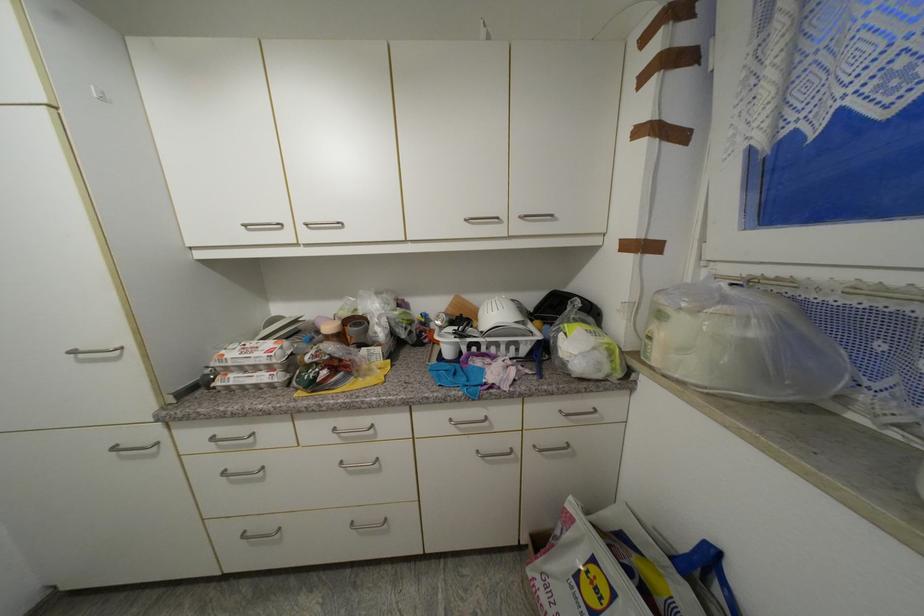
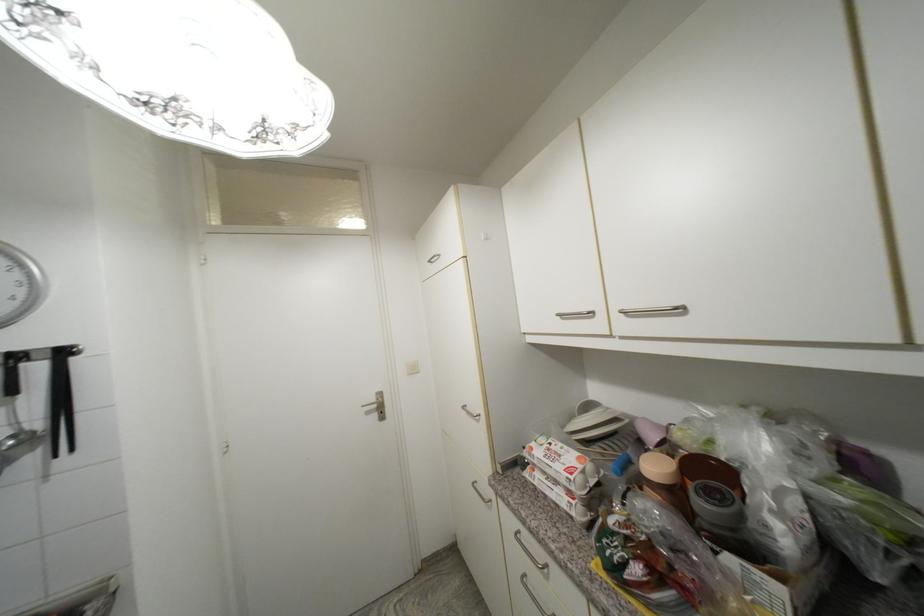
The point at (314,223) is marked in the first image. Where is the corresponding point in the second image?

(631, 309)